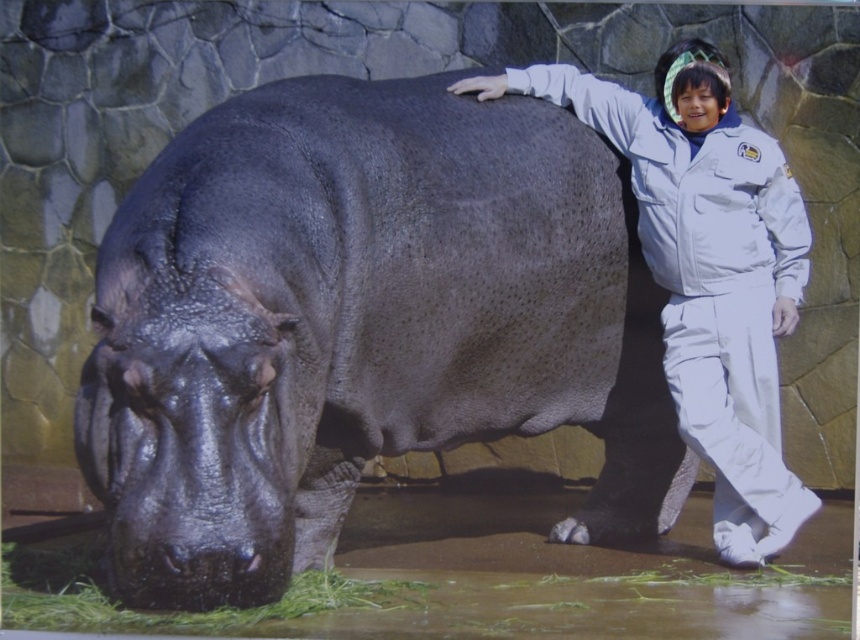
Question: Which object is closer to the camera taking this photo?

Choices:
 (A) white matte uniform at right
 (B) shiny dark gray hippo at center

Answer: (B)

Question: Does shiny dark gray hippo at center have a larger size compared to white matte uniform at right?

Choices:
 (A) no
 (B) yes

Answer: (B)

Question: Is shiny dark gray hippo at center below white matte uniform at right?

Choices:
 (A) yes
 (B) no

Answer: (A)

Question: Which point is farther to the camera?

Choices:
 (A) shiny dark gray hippo at center
 (B) white matte uniform at right

Answer: (B)

Question: Can you confirm if shiny dark gray hippo at center is positioned to the right of white matte uniform at right?

Choices:
 (A) no
 (B) yes

Answer: (A)